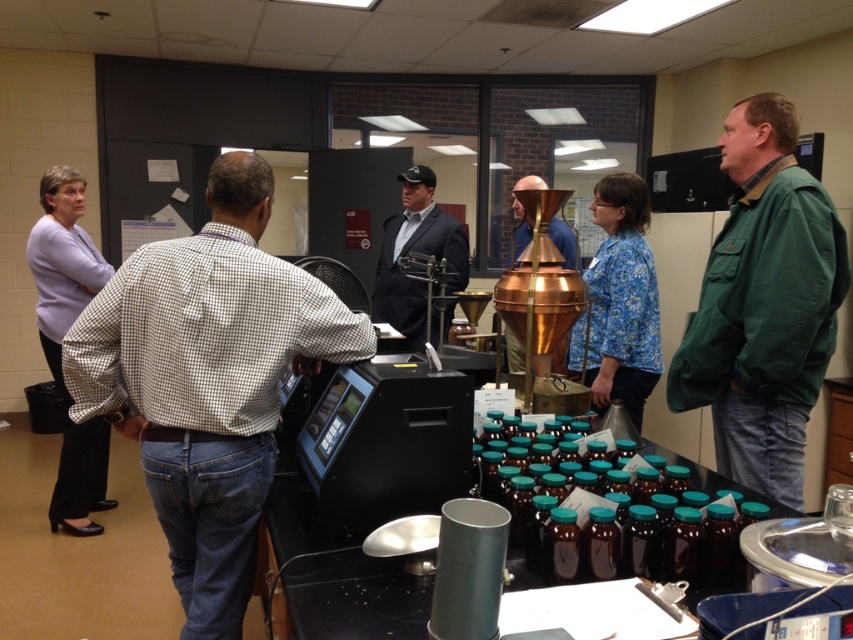
You are a researcher in the lab and need to identify the clothing items. Which item is taller between the white checkered shirt at center and the black suit at center?

The white checkered shirt at center is taller than the black suit at center.

You are organizing a clothing donation drive and need to determine which items can fit into a standard donation bin. The bin has a width limit of 50 cm. Given that the green cotton jacket at right and the black suit at center are the only items available, which one is more likely to fit based on their widths?

The green cotton jacket at right has a lesser width compared to the black suit at center, so it is more likely to fit into the 50 cm width donation bin.